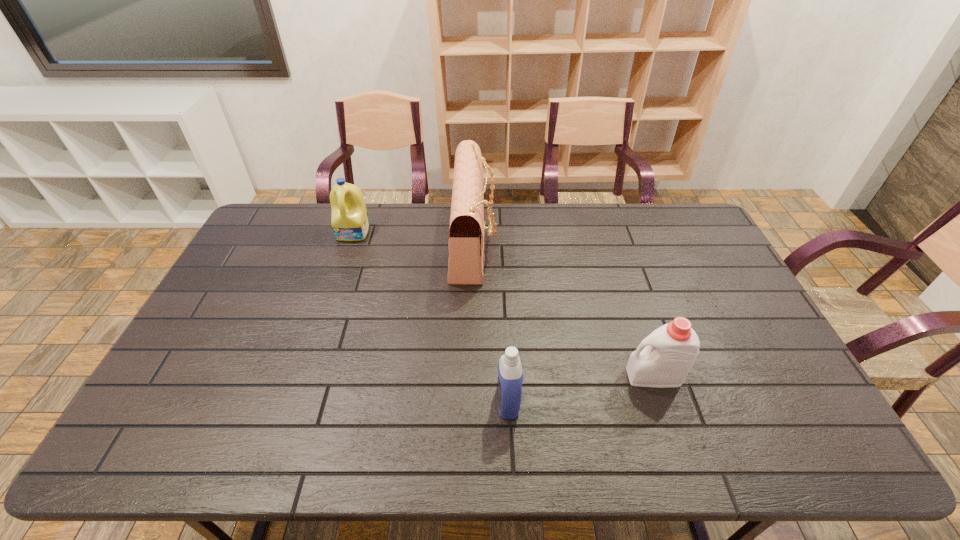
Identify which detergent is located as the second nearest to the leftmost object. Please provide its 2D coordinates. Your answer should be formatted as a tuple, i.e. [(x, y)], where the tuple contains the x and y coordinates of a point satisfying the conditions above.

[(663, 359)]

You are a GUI agent. You are given a task and a screenshot of the screen. Output one action in this format:
    pyautogui.click(x=<x>, y=<y>)
    Task: Click on the vacant area in the image that satisfies the following two spatial constraints: 1. on the label of the second detergent from left to right; 2. on the right side of the farthest detergent
    This screenshot has width=960, height=540.
    Given the screenshot: What is the action you would take?
    pyautogui.click(x=298, y=402)

Locate an element on the screen. vacant space that satisfies the following two spatial constraints: 1. on the label of the second detergent from left to right; 2. on the right side of the farthest detergent is located at coordinates (298, 402).

Image resolution: width=960 pixels, height=540 pixels. In order to click on free space that satisfies the following two spatial constraints: 1. on the label of the second detergent from left to right; 2. on the right side of the leftmost detergent in this screenshot , I will do `click(298, 402)`.

At what (x,y) coordinates should I click in order to perform the action: click on vacant position in the image that satisfies the following two spatial constraints: 1. on the back side of the second detergent from left to right; 2. on the front-facing side of the tallest object. Please return your answer as a coordinate pair (x, y). Looking at the image, I should click on (499, 241).

Locate an element on the screen. vacant space that satisfies the following two spatial constraints: 1. on the front-facing side of the tallest object; 2. on the right side of the second detergent from right to left is located at coordinates [x=470, y=402].

This screenshot has height=540, width=960. Find the location of `vacant space that satisfies the following two spatial constraints: 1. on the front-facing side of the handbag; 2. on the right side of the second detergent from right to left`. vacant space that satisfies the following two spatial constraints: 1. on the front-facing side of the handbag; 2. on the right side of the second detergent from right to left is located at coordinates (470, 402).